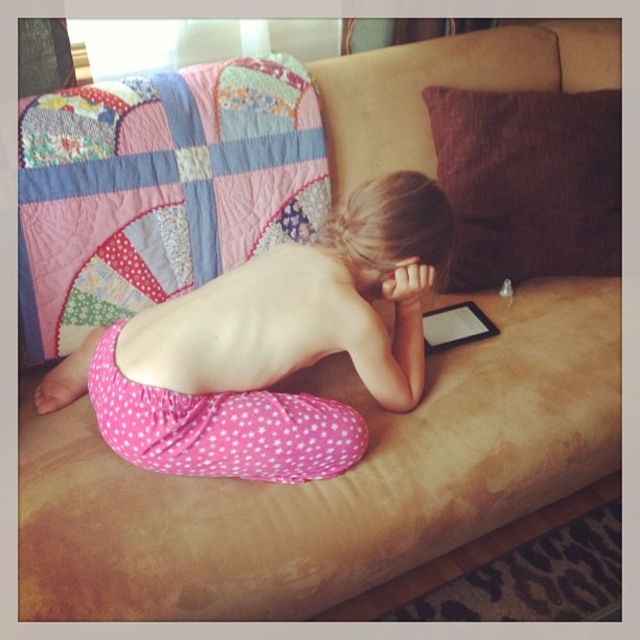
Question: From the image, what is the correct spatial relationship of patchwork fabric quilt at upper left in relation to brown cotton pillow at upper right?

Choices:
 (A) left
 (B) right

Answer: (A)

Question: From the image, what is the correct spatial relationship of patchwork fabric quilt at upper left in relation to brown cotton pillow at upper right?

Choices:
 (A) below
 (B) above

Answer: (A)

Question: Among these objects, which one is farthest from the camera?

Choices:
 (A) pink polka dot fabric at lower center
 (B) brown cotton pillow at upper right

Answer: (B)

Question: Which point is closer to the camera?

Choices:
 (A) black matte tablet at center
 (B) pink polka dot fabric at lower center
 (C) brown cotton pillow at upper right

Answer: (B)

Question: Where is pink polka dot fabric at lower center located in relation to black matte tablet at center in the image?

Choices:
 (A) right
 (B) left

Answer: (B)

Question: Which point is farther from the camera taking this photo?

Choices:
 (A) 108,96
 (B) 468,262
 (C) 374,294
 (D) 429,330

Answer: (B)